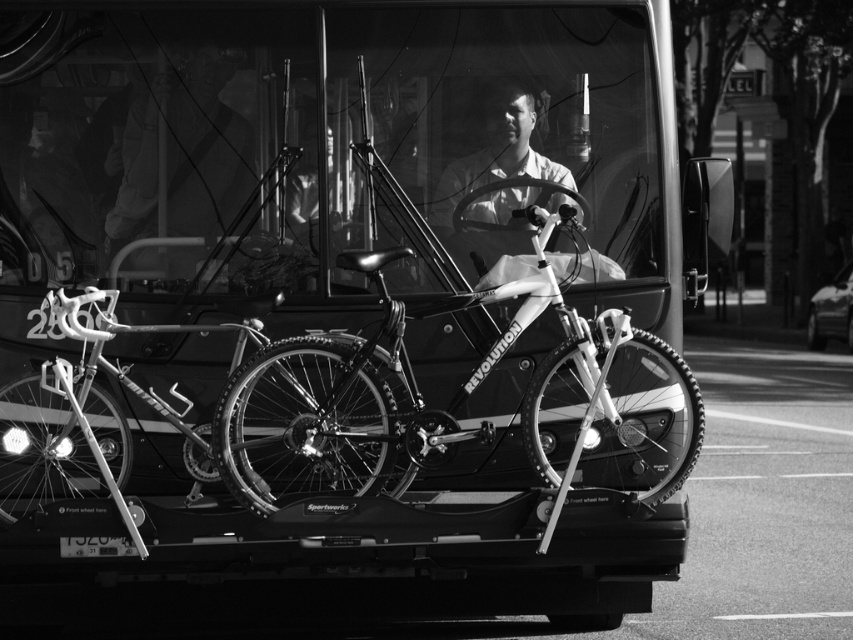
You are a delivery person needing to load a new bicycle onto the bus rack. The new bicycle is 1.2 meters wide. The rack currently holds the metallic silver bicycle at center and the shiny silver bicycle at center. Which existing bicycle on the rack has a width that could potentially allow the new bicycle to fit alongside it?

The metallic silver bicycle at center has a greater width than the shiny silver bicycle at center. Since the new bicycle is 1.2 meters wide, it might fit alongside the shiny silver bicycle at center if there is sufficient space remaining in the rack.

Looking at this image, you are standing on the sidewalk next to the bus and want to check if you can safely reach the metallic silver bicycle at center to unlock it. Considering your height is 5 feet 6 inches, can you comfortably reach the bike without climbing onto the bus?

The metallic silver bicycle at center is 21.97 feet away from the viewer. Since the distance is quite large, you cannot comfortably reach the bike without moving closer or using a tool.

You are a passenger on the bus and want to take a photo of the shiny silver bicycle at center without including the smooth white shirt at center in the frame. Is this possible based on their positions?

Yes, since the shiny silver bicycle at center is in front of the smooth white shirt at center, you can take a photo of the shiny silver bicycle at center without including the smooth white shirt at center by focusing on the bicycle and adjusting your angle to block the shirt from the view.